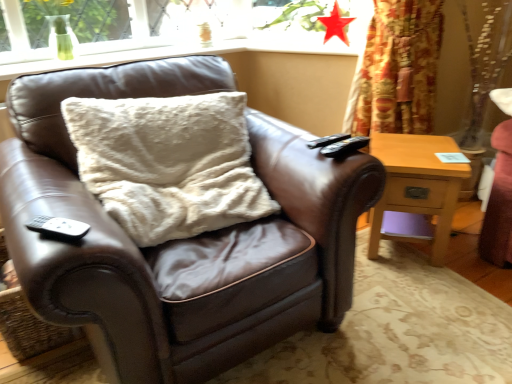
Locate an element on the screen. This screenshot has width=512, height=384. free location to the left of matte red star at upper center is located at coordinates (302, 40).